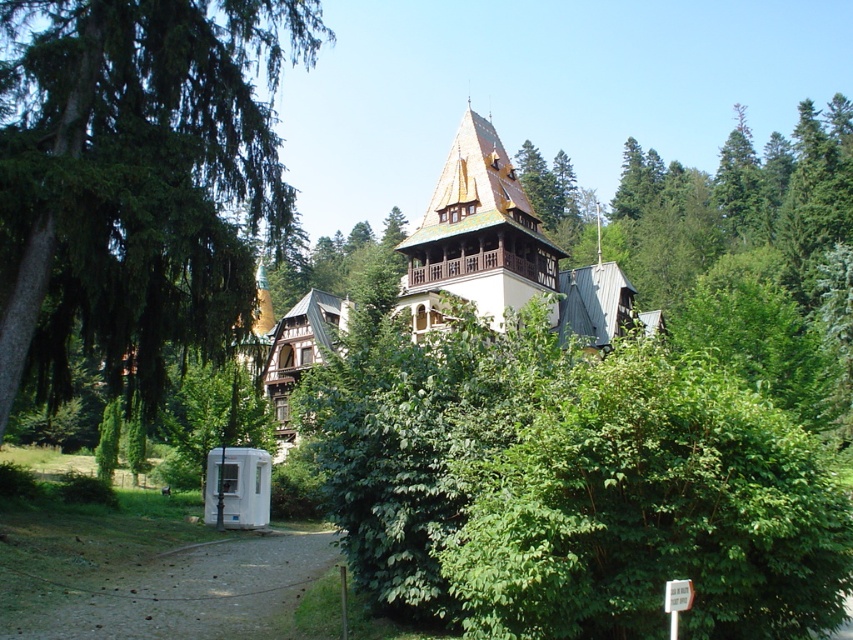
Locate an element on the screen. The image size is (853, 640). green leafy tree at left is located at coordinates (134, 176).

Who is more forward, (154,145) or (467,108)?

Point (154,145)

Which is in front, point (93, 81) or point (476, 252)?

Point (93, 81)

At what (x,y) coordinates should I click in order to perform the action: click on green leafy tree at left. Please return your answer as a coordinate pair (x, y). The image size is (853, 640). Looking at the image, I should click on click(134, 176).